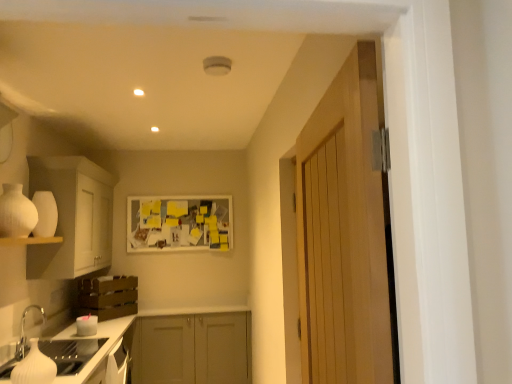
Question: Considering the relative sizes of white matte vase at left and white glossy sink at lower left in the image provided, is white matte vase at left smaller than white glossy sink at lower left?

Choices:
 (A) no
 (B) yes

Answer: (A)

Question: Are white matte vase at left and white glossy sink at lower left far apart?

Choices:
 (A) yes
 (B) no

Answer: (B)

Question: Could you tell me if white matte vase at left is turned towards white glossy sink at lower left?

Choices:
 (A) no
 (B) yes

Answer: (A)

Question: Is white glossy sink at lower left completely or partially inside white matte vase at left?

Choices:
 (A) yes
 (B) no

Answer: (B)

Question: Can you confirm if white matte vase at left is shorter than white glossy sink at lower left?

Choices:
 (A) yes
 (B) no

Answer: (A)

Question: From the image's perspective, does white matte vase at left appear lower than white glossy sink at lower left?

Choices:
 (A) yes
 (B) no

Answer: (B)

Question: Would you say brown wooden crate at lower left, which is counted as the second cabinetry, starting from the bottom, is outside white matte cabinet at left, which is the 3th cabinetry from bottom to top?

Choices:
 (A) no
 (B) yes

Answer: (B)

Question: Considering the relative sizes of brown wooden crate at lower left, which is counted as the second cabinetry, starting from the bottom, and white matte cabinet at left, which is the 3th cabinetry from bottom to top, in the image provided, is brown wooden crate at lower left, which is counted as the second cabinetry, starting from the bottom, shorter than white matte cabinet at left, which is the 3th cabinetry from bottom to top,?

Choices:
 (A) no
 (B) yes

Answer: (B)

Question: Can you confirm if brown wooden crate at lower left, which appears as the second cabinetry when viewed from the top, is positioned to the left of white matte cabinet at left, which is the first cabinetry in top-to-bottom order?

Choices:
 (A) yes
 (B) no

Answer: (B)

Question: Considering the relative sizes of brown wooden crate at lower left, which appears as the second cabinetry when viewed from the top, and white matte cabinet at left, which is the 3th cabinetry from bottom to top, in the image provided, is brown wooden crate at lower left, which appears as the second cabinetry when viewed from the top, thinner than white matte cabinet at left, which is the 3th cabinetry from bottom to top,?

Choices:
 (A) yes
 (B) no

Answer: (A)

Question: Does brown wooden crate at lower left, which is counted as the second cabinetry, starting from the bottom, touch white matte cabinet at left, which is the 3th cabinetry from bottom to top?

Choices:
 (A) yes
 (B) no

Answer: (B)

Question: Is brown wooden crate at lower left, which is counted as the second cabinetry, starting from the bottom, in front of white matte cabinet at left, which is the 3th cabinetry from bottom to top?

Choices:
 (A) no
 (B) yes

Answer: (A)

Question: Does brown wooden crate at lower left, which appears as the second cabinetry when viewed from the top, have a lesser width compared to wooden door at right?

Choices:
 (A) yes
 (B) no

Answer: (B)